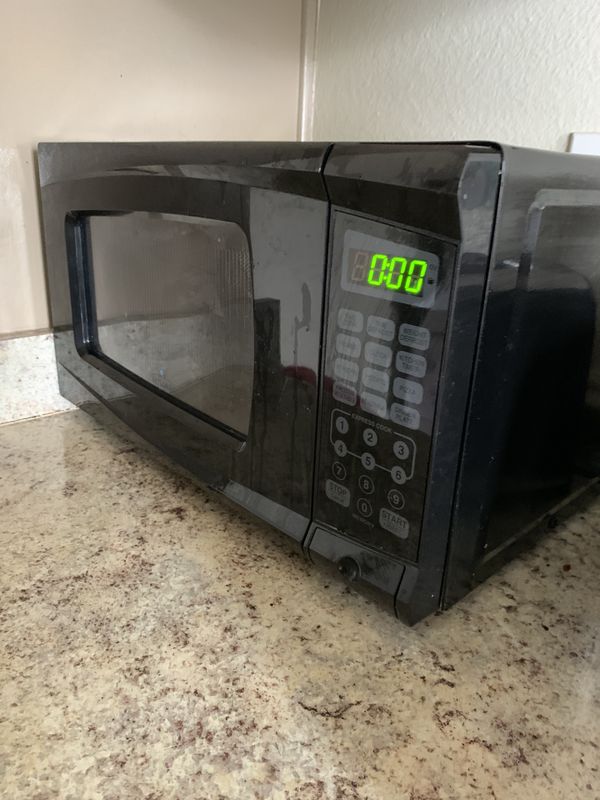
Find the location of a particular element. The width and height of the screenshot is (600, 800). microwave is located at coordinates (430, 380).